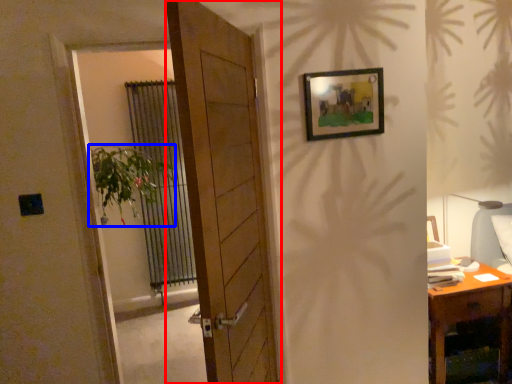
Question: Which of the following is the closest to the observer, door (highlighted by a red box) or houseplant (highlighted by a blue box)?

Choices:
 (A) door
 (B) houseplant

Answer: (A)